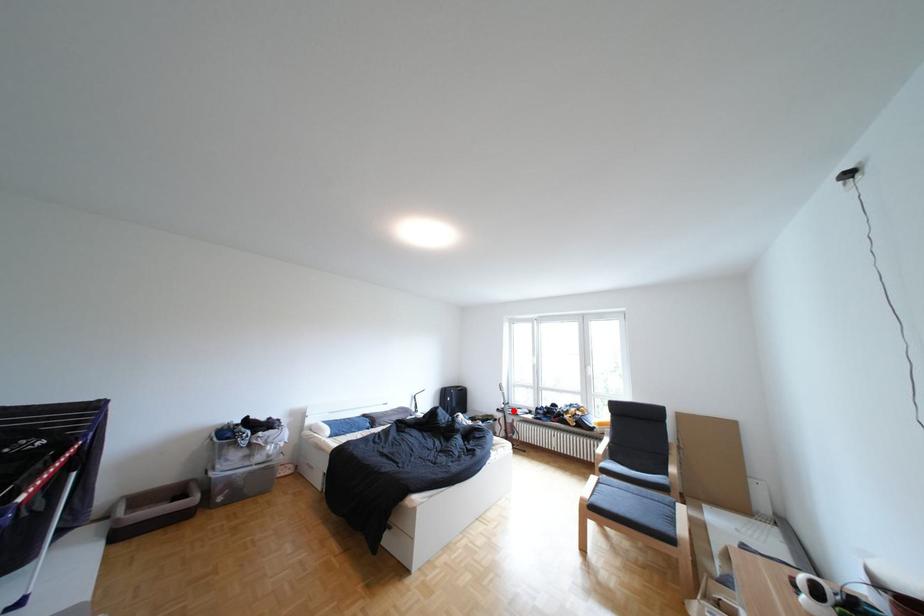
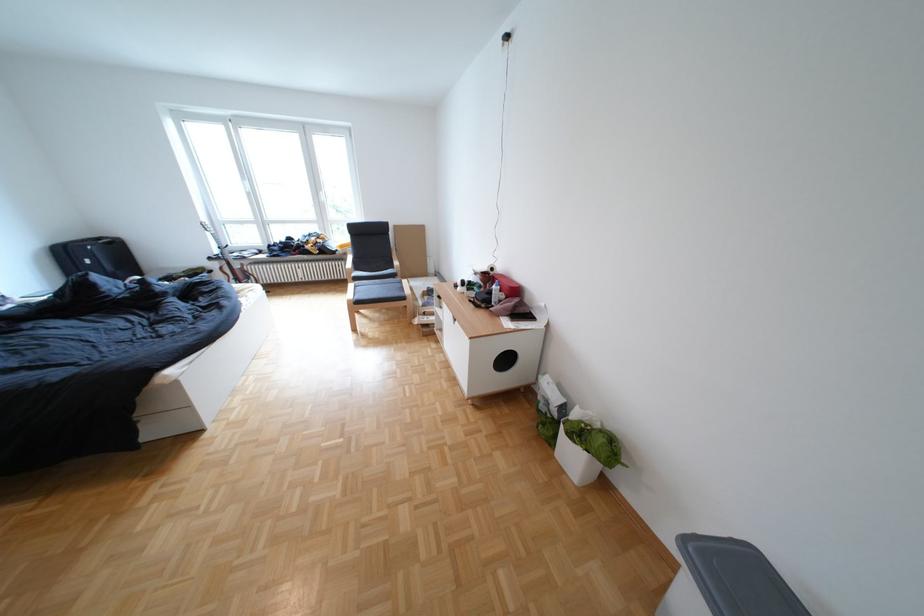
Locate, in the second image, the point that corresponds to the highlighted location in the first image.

(225, 259)